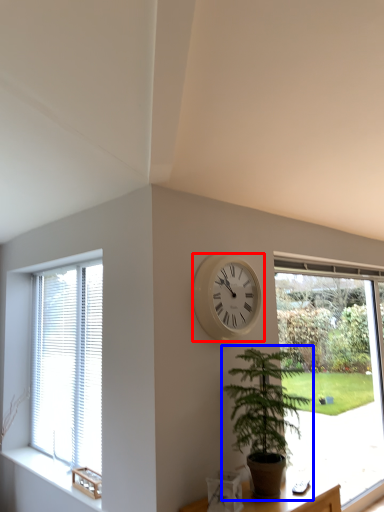
Question: Which point is closer to the camera, wall clock (highlighted by a red box) or houseplant (highlighted by a blue box)?

Choices:
 (A) wall clock
 (B) houseplant

Answer: (B)